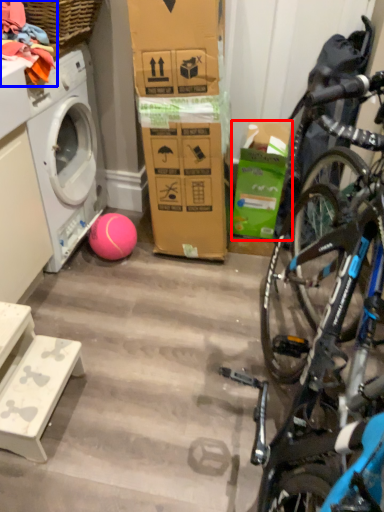
Question: Which object is closer to the camera taking this photo, box (highlighted by a red box) or clothing (highlighted by a blue box)?

Choices:
 (A) box
 (B) clothing

Answer: (B)